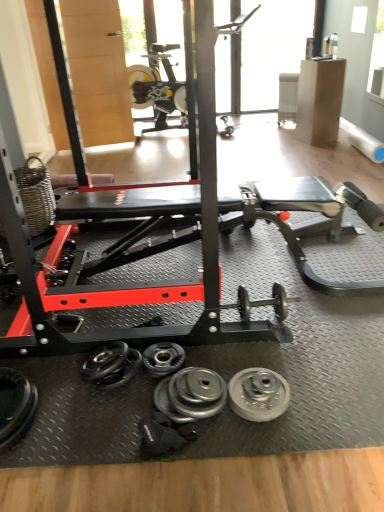
The image size is (384, 512). Identify the location of free spot in front of silver metallic dumbbell at center, acting as the third dumbbell starting from the left. (209, 452).